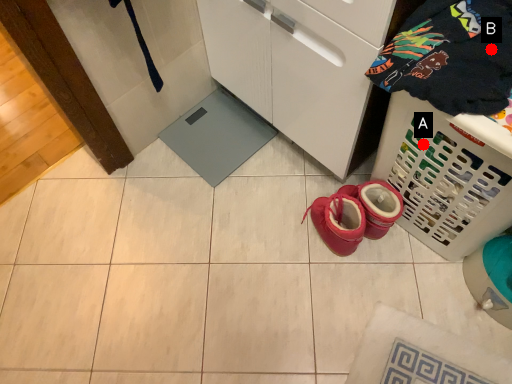
Question: Two points are circled on the image, labeled by A and B beside each circle. Which of the following is the farthest from the observer?

Choices:
 (A) A is further
 (B) B is further

Answer: (A)